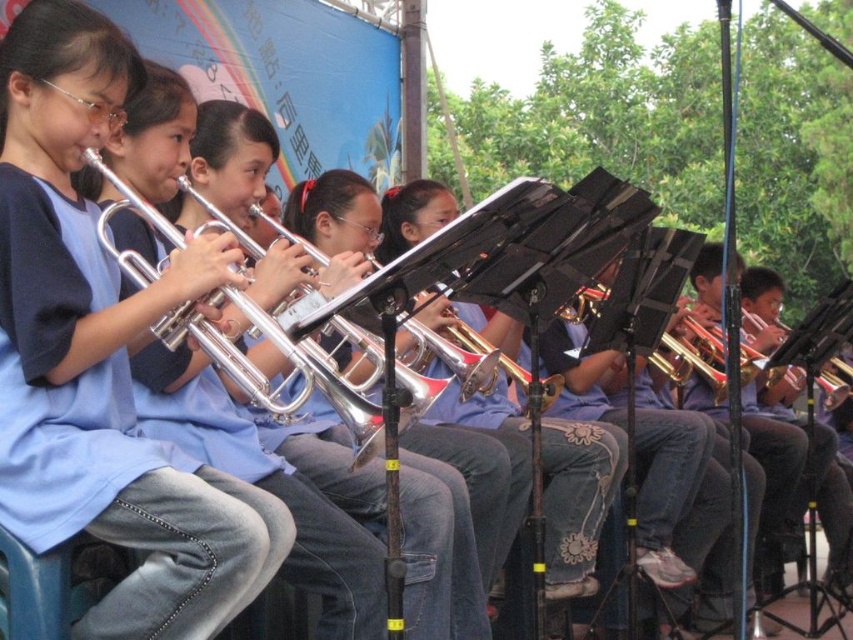
Question: Estimate the real-world distances between objects in this image. Which object is closer to the brushed metal trumpet at center?

Choices:
 (A) silver shiny trumpet at center
 (B) matte silver trumpet at center

Answer: (B)

Question: Does silver shiny trumpet at center appear on the left side of brushed metal trumpet at center?

Choices:
 (A) no
 (B) yes

Answer: (B)

Question: Considering the relative positions of silver shiny trumpet at center and brushed metal trumpet at center in the image provided, where is silver shiny trumpet at center located with respect to brushed metal trumpet at center?

Choices:
 (A) above
 (B) below

Answer: (A)

Question: Which of the following is the farthest from the observer?

Choices:
 (A) (450, 365)
 (B) (300, 262)

Answer: (A)

Question: Is matte silver trumpet at center bigger than silver shiny trumpet at center?

Choices:
 (A) yes
 (B) no

Answer: (A)

Question: Considering the real-world distances, which object is closest to the silver shiny trumpet at center?

Choices:
 (A) brushed metal trumpet at center
 (B) matte silver trumpet at center

Answer: (B)